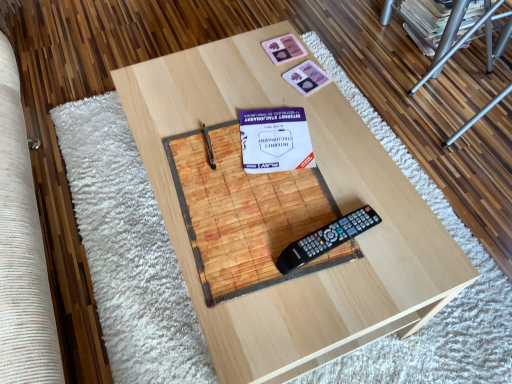
In order to click on free spot in front of pink matte playing card at upper center, acting as the 1th square starting from the bottom in this screenshot , I will do `click(329, 124)`.